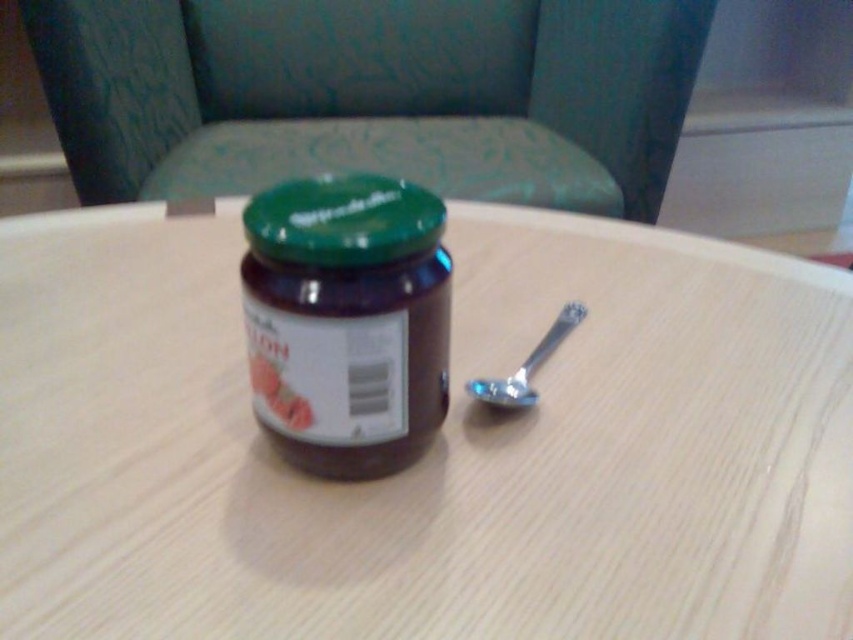
Between point (397, 246) and point (561, 310), which one is positioned in front?

Point (397, 246) is in front.

Which of these two, green matte jar lid at center or silver metallic spoon at lower right, stands shorter?

Standing shorter between the two is silver metallic spoon at lower right.

Where is `green matte jar lid at center`? green matte jar lid at center is located at coordinates (343, 221).

Locate an element on the screen. This screenshot has width=853, height=640. green matte jar lid at center is located at coordinates point(343,221).

Is matte glass jar at center bigger than green matte jar lid at center?

Indeed, matte glass jar at center has a larger size compared to green matte jar lid at center.

Where is `matte glass jar at center`? This screenshot has height=640, width=853. matte glass jar at center is located at coordinates (x=347, y=321).

At what (x,y) coordinates should I click in order to perform the action: click on matte glass jar at center. Please return your answer as a coordinate pair (x, y). Looking at the image, I should click on (347, 321).

You are a GUI agent. You are given a task and a screenshot of the screen. Output one action in this format:
    pyautogui.click(x=<x>, y=<y>)
    Task: Click on the matte glass jar at center
    The width and height of the screenshot is (853, 640).
    Given the screenshot: What is the action you would take?
    pyautogui.click(x=347, y=321)

Who is higher up, wooden table at center or silver metallic spoon at lower right?

Positioned higher is wooden table at center.

How far apart are wooden table at center and silver metallic spoon at lower right?

wooden table at center and silver metallic spoon at lower right are 5.56 inches apart.

Which is behind, point (566, 472) or point (495, 381)?

The point (495, 381) is behind.

Locate an element on the screen. Image resolution: width=853 pixels, height=640 pixels. wooden table at center is located at coordinates (431, 449).